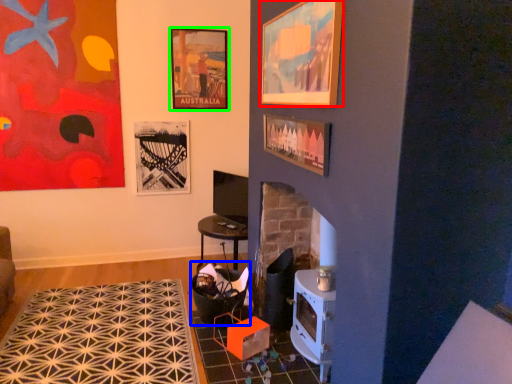
Question: Considering the real-world distances, which object is closest to picture frame (highlighted by a red box)? rocking chair (highlighted by a blue box) or picture frame (highlighted by a green box).

Choices:
 (A) rocking chair
 (B) picture frame

Answer: (A)